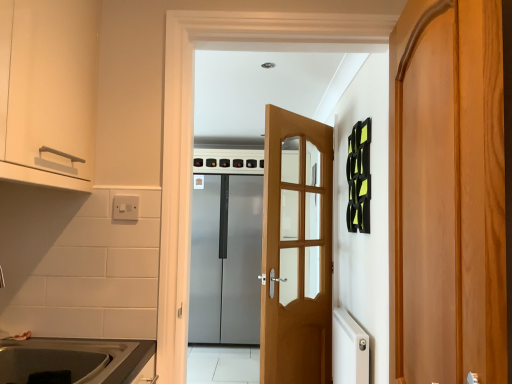
Question: Would you say satin silver refrigerator at center, positioned as the 1th door in left-to-right order, is inside or outside wooden door at right, the 3th door in the left-to-right sequence?

Choices:
 (A) outside
 (B) inside

Answer: (A)

Question: Is satin silver refrigerator at center, the third door viewed from the right, taller or shorter than wooden door at right, which appears as the 3th door when viewed from the back?

Choices:
 (A) short
 (B) tall

Answer: (B)

Question: Estimate the real-world distances between objects in this image. Which object is farther from the white ribbed radiator at lower right?

Choices:
 (A) wooden door at right, the 3th door in the left-to-right sequence
 (B) matte stainless steel sink at lower left
 (C) light brown wooden door at center, which is the 2th door from right to left
 (D) matte white cabinet at upper left
 (E) satin silver refrigerator at center, the third door viewed from the right

Answer: (E)

Question: Which object is positioned closest to the white ribbed radiator at lower right?

Choices:
 (A) matte white cabinet at upper left
 (B) light brown wooden door at center, which is the second door from left to right
 (C) satin silver refrigerator at center, the first door when ordered from back to front
 (D) wooden door at right, the 3th door in the left-to-right sequence
 (E) matte stainless steel sink at lower left

Answer: (B)